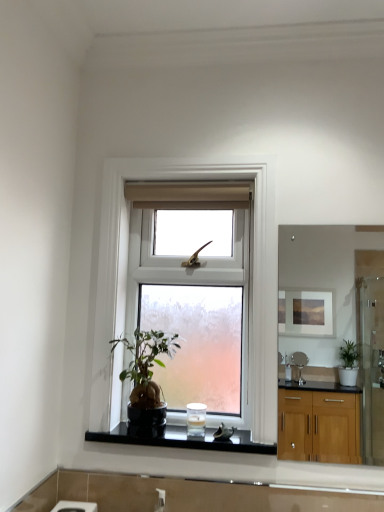
Question: Is clear glass window at center behind matte wooden mirror at upper right?

Choices:
 (A) yes
 (B) no

Answer: (A)

Question: Considering the relative positions of clear glass window at center and matte wooden mirror at upper right in the image provided, is clear glass window at center to the left of matte wooden mirror at upper right from the viewer's perspective?

Choices:
 (A) yes
 (B) no

Answer: (A)

Question: Can matte wooden mirror at upper right be found inside clear glass window at center?

Choices:
 (A) no
 (B) yes

Answer: (A)

Question: Does clear glass window at center have a lesser width compared to matte wooden mirror at upper right?

Choices:
 (A) no
 (B) yes

Answer: (A)

Question: Is clear glass window at center far away from matte wooden mirror at upper right?

Choices:
 (A) no
 (B) yes

Answer: (B)

Question: Is matte wooden mirror at upper right at the back of clear glass window at center?

Choices:
 (A) yes
 (B) no

Answer: (B)

Question: Is white frosted glass candle at center bigger than clear glass window at center?

Choices:
 (A) no
 (B) yes

Answer: (A)

Question: Does white frosted glass candle at center appear on the left side of clear glass window at center?

Choices:
 (A) no
 (B) yes

Answer: (A)

Question: Does white frosted glass candle at center have a lesser height compared to clear glass window at center?

Choices:
 (A) no
 (B) yes

Answer: (B)

Question: Is white frosted glass candle at center oriented away from clear glass window at center?

Choices:
 (A) yes
 (B) no

Answer: (A)

Question: Could you tell me if white frosted glass candle at center is facing clear glass window at center?

Choices:
 (A) yes
 (B) no

Answer: (A)

Question: From a real-world perspective, is white frosted glass candle at center below clear glass window at center?

Choices:
 (A) yes
 (B) no

Answer: (A)

Question: From a real-world perspective, is matte wooden mirror at upper right located beneath green matte houseplant at center?

Choices:
 (A) no
 (B) yes

Answer: (A)